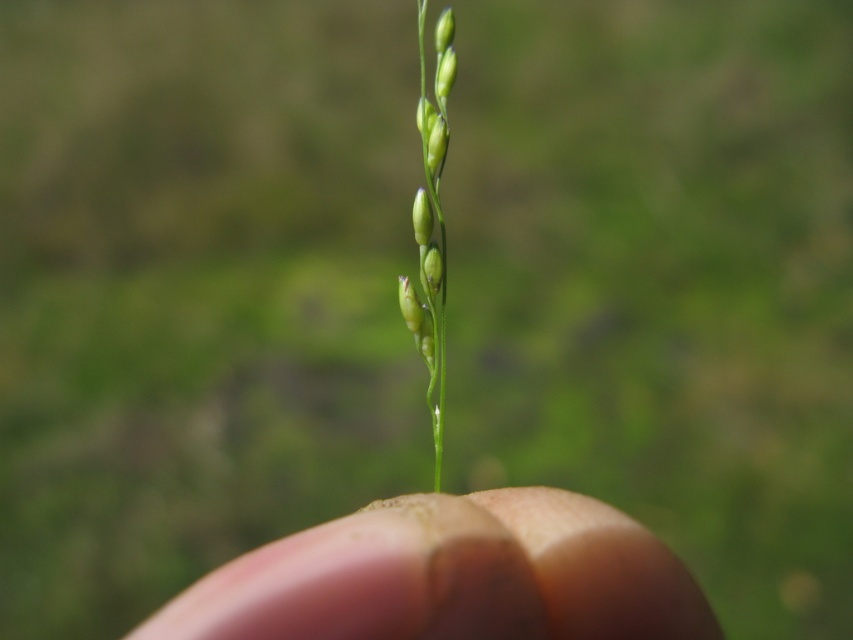
Question: Observing the image, what is the correct spatial positioning of flesh-toned skin at center in reference to green matte grass at center?

Choices:
 (A) right
 (B) left

Answer: (B)

Question: Can you confirm if flesh-toned skin at center is smaller than green matte grass at center?

Choices:
 (A) yes
 (B) no

Answer: (B)

Question: From the image, what is the correct spatial relationship of flesh-toned skin at center in relation to green matte grass at center?

Choices:
 (A) above
 (B) below

Answer: (B)

Question: Which of the following is the farthest from the observer?

Choices:
 (A) flesh-toned skin at center
 (B) green matte grass at center

Answer: (B)

Question: Which of the following is the closest to the observer?

Choices:
 (A) flesh-toned skin at center
 (B) green matte grass at center

Answer: (A)